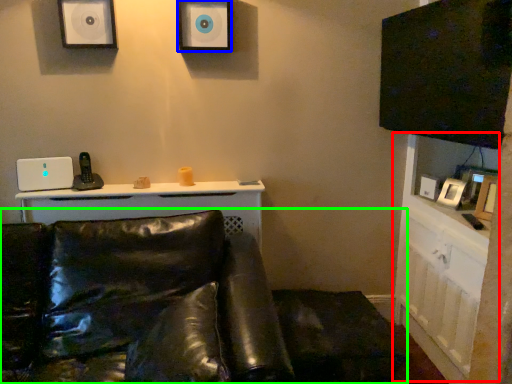
Question: Which is farther away from dresser (highlighted by a red box)? speaker (highlighted by a blue box) or studio couch (highlighted by a green box)?

Choices:
 (A) speaker
 (B) studio couch

Answer: (A)